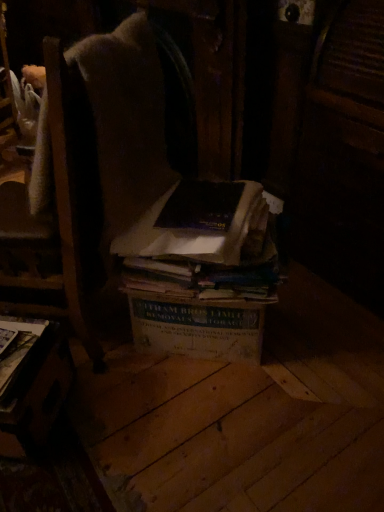
This screenshot has width=384, height=512. Identify the location of vacant space situated above hardcover book at lower left, the 1th book positioned from the left (from a real-world perspective). (15, 346).